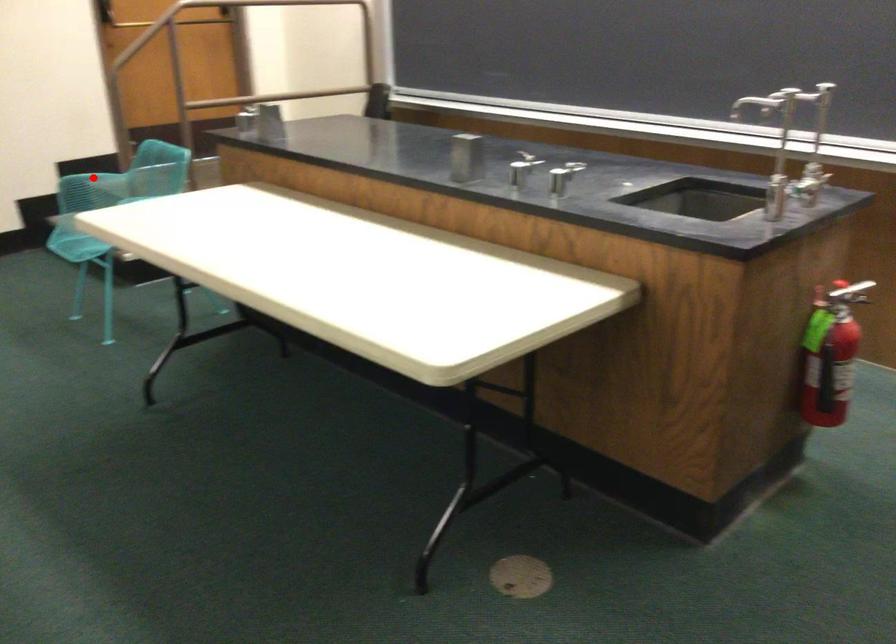
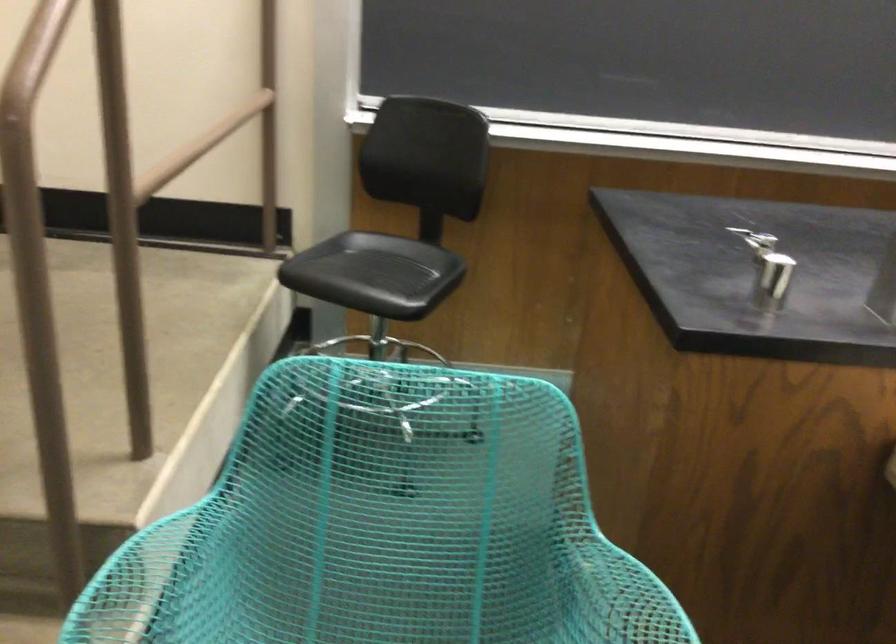
Question: A red point is marked in image1. In image2, is the corresponding 3D point closer to the camera or farther? Reply with the corresponding letter.

Choices:
 (A) The corresponding 3D point is closer.
 (B) The corresponding 3D point is farther.

Answer: (A)